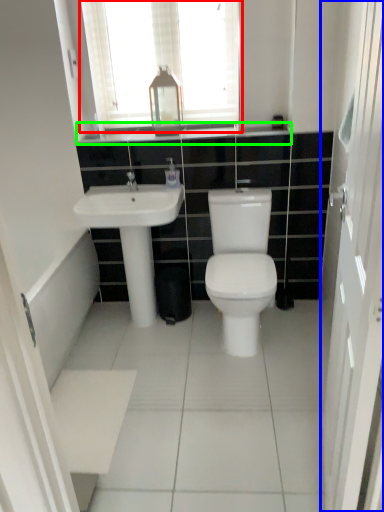
Question: Which is nearer to the window (highlighted by a red box)? screen door (highlighted by a blue box) or counter top (highlighted by a green box).

Choices:
 (A) screen door
 (B) counter top

Answer: (B)